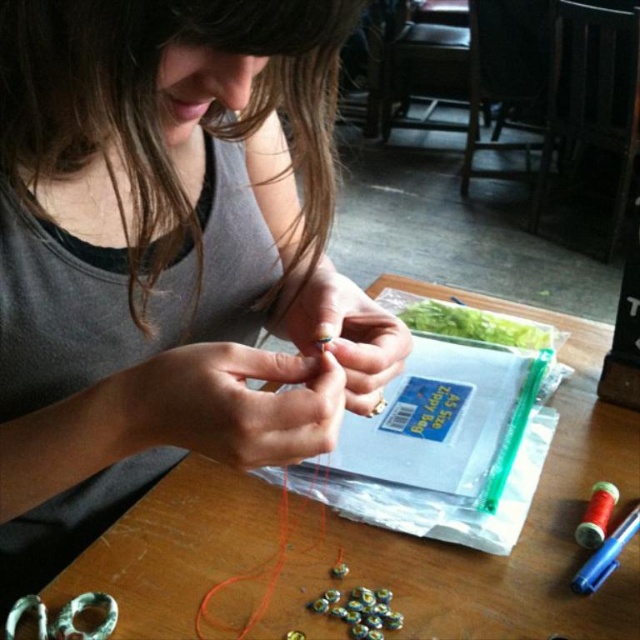
Question: Is matte gray tank top at center positioned at the back of wooden table at center?

Choices:
 (A) no
 (B) yes

Answer: (A)

Question: Which point is closer to the camera taking this photo?

Choices:
 (A) (120, 637)
 (B) (180, 355)

Answer: (B)

Question: Can you confirm if matte gray tank top at center is bigger than wooden table at center?

Choices:
 (A) no
 (B) yes

Answer: (A)

Question: Does matte gray tank top at center appear on the right side of wooden table at center?

Choices:
 (A) yes
 (B) no

Answer: (B)

Question: Which of the following is the farthest from the observer?

Choices:
 (A) (36, 316)
 (B) (547, 518)

Answer: (B)

Question: Which point is farther to the camera?

Choices:
 (A) (244, 408)
 (B) (579, 449)

Answer: (B)